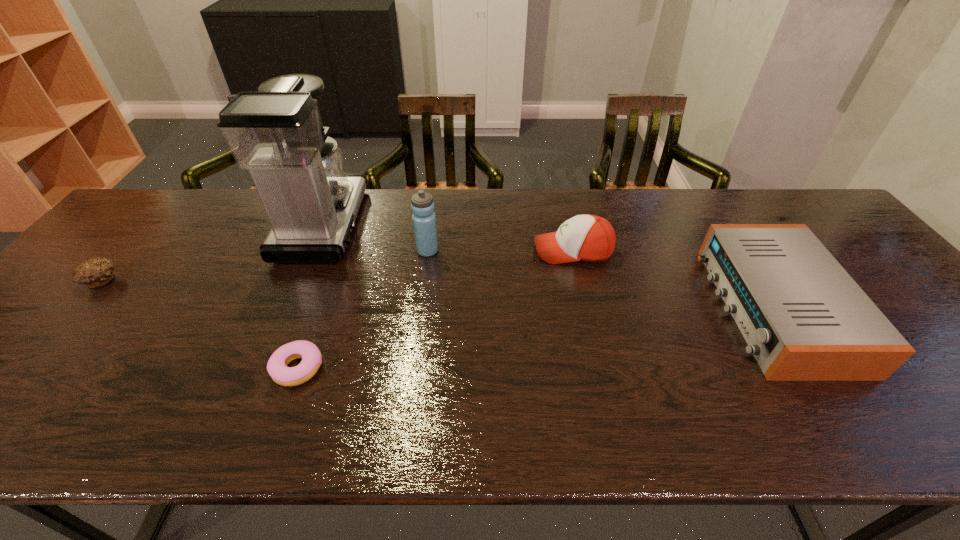
Identify the location of vacant region between the shortest object and the second tallest object. (363, 310).

Where is `unoccupied area between the second shortest object and the baseball cap`? The image size is (960, 540). unoccupied area between the second shortest object and the baseball cap is located at coordinates (338, 266).

Locate an element on the screen. Image resolution: width=960 pixels, height=540 pixels. free space between the baseball cap and the shortest object is located at coordinates (x=435, y=309).

At what (x,y) coordinates should I click in order to perform the action: click on free space between the doughnut and the coffee maker. Please return your answer as a coordinate pair (x, y). The width and height of the screenshot is (960, 540). Looking at the image, I should click on (311, 296).

At what (x,y) coordinates should I click in order to perform the action: click on vacant space that's between the fifth object from left to right and the second shortest object. Please return your answer as a coordinate pair (x, y). The width and height of the screenshot is (960, 540). Looking at the image, I should click on (338, 266).

This screenshot has width=960, height=540. I want to click on object that stands as the fourth closest to the fifth tallest object, so click(x=589, y=238).

Select which object is the fourth closest to the water bottle. Please provide its 2D coordinates. Your answer should be formatted as a tuple, i.e. [(x, y)], where the tuple contains the x and y coordinates of a point satisfying the conditions above.

[(804, 318)]

Locate an element on the screen. Image resolution: width=960 pixels, height=540 pixels. free region that satisfies the following two spatial constraints: 1. on the back side of the shortest object; 2. on the left side of the water bottle is located at coordinates (339, 251).

This screenshot has height=540, width=960. Identify the location of vacant area in the image that satisfies the following two spatial constraints: 1. at the front of the shortest object where the controls are located; 2. on the left side of the tallest object. (264, 368).

Where is `vacant space that satisfies the following two spatial constraints: 1. at the front of the shortest object where the controls are located; 2. on the left side of the coffee maker`? vacant space that satisfies the following two spatial constraints: 1. at the front of the shortest object where the controls are located; 2. on the left side of the coffee maker is located at coordinates (264, 368).